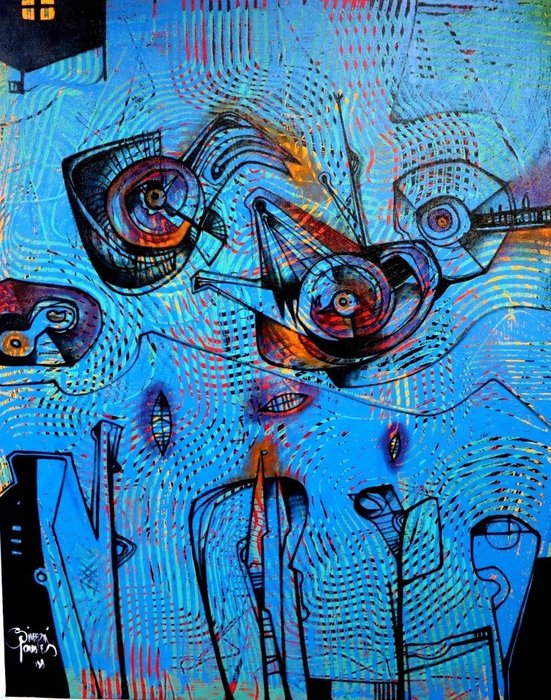
Locate an element on the screen. The width and height of the screenshot is (551, 700). window is located at coordinates (46, 13).